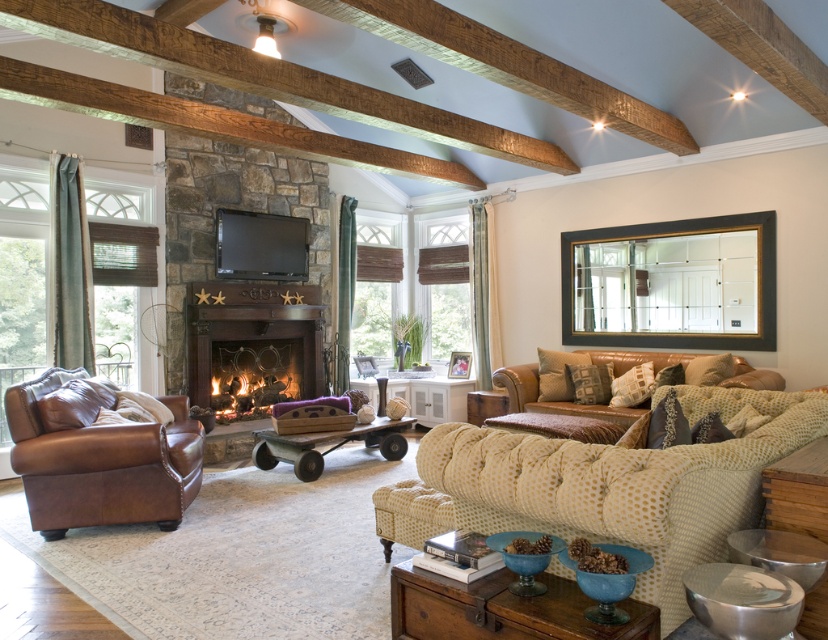
Is yellow dotted fabric couch at center wider than brown leather armchair at left?

Yes, yellow dotted fabric couch at center is wider than brown leather armchair at left.

Who is higher up, yellow dotted fabric couch at center or brown leather armchair at left?

Positioned higher is yellow dotted fabric couch at center.

Image resolution: width=828 pixels, height=640 pixels. Identify the location of yellow dotted fabric couch at center. (604, 486).

Between point (159, 461) and point (508, 381), which one is positioned behind?

Point (508, 381)

Where is `brown leather armchair at left`? This screenshot has width=828, height=640. brown leather armchair at left is located at coordinates (100, 465).

Find the location of a particular element. Image resolution: width=828 pixels, height=640 pixels. brown leather armchair at left is located at coordinates (100, 465).

Does brown leather armchair at left appear over rustic wood coffee table at center?

Yes.

The image size is (828, 640). Describe the element at coordinates (100, 465) in the screenshot. I see `brown leather armchair at left` at that location.

The height and width of the screenshot is (640, 828). I want to click on brown leather armchair at left, so click(100, 465).